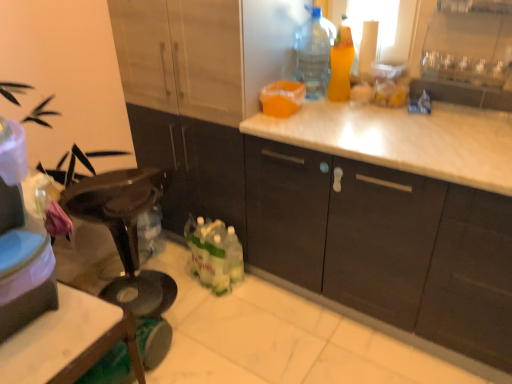
Question: Is transparent plastic bottle at upper right, the 1th bottle from the left, thinner than translucent orange spray bottle at upper right, marked as the 1th bottle in a right-to-left arrangement?

Choices:
 (A) yes
 (B) no

Answer: (B)

Question: Is transparent plastic bottle at upper right, the 1th bottle from the left, in contact with translucent orange spray bottle at upper right, marked as the 1th bottle in a right-to-left arrangement?

Choices:
 (A) yes
 (B) no

Answer: (A)

Question: Does transparent plastic bottle at upper right, the 1th bottle from the left, turn towards translucent orange spray bottle at upper right, marked as the 1th bottle in a right-to-left arrangement?

Choices:
 (A) no
 (B) yes

Answer: (A)

Question: Is transparent plastic bottle at upper right, the 1th bottle from the left, wider than translucent orange spray bottle at upper right, marked as the 1th bottle in a right-to-left arrangement?

Choices:
 (A) no
 (B) yes

Answer: (B)

Question: From a real-world perspective, is transparent plastic bottle at upper right, the 2th bottle positioned from the right, located higher than translucent orange spray bottle at upper right, marked as the second bottle in a left-to-right arrangement?

Choices:
 (A) yes
 (B) no

Answer: (A)

Question: Can you confirm if transparent plastic bottle at upper right, the 2th bottle positioned from the right, is taller than translucent orange spray bottle at upper right, marked as the second bottle in a left-to-right arrangement?

Choices:
 (A) no
 (B) yes

Answer: (B)

Question: Is translucent orange spray bottle at upper right, marked as the 1th bottle in a right-to-left arrangement, further to the viewer compared to transparent plastic bottle at upper right, the 2th bottle positioned from the right?

Choices:
 (A) yes
 (B) no

Answer: (B)

Question: From a real-world perspective, does translucent orange spray bottle at upper right, marked as the second bottle in a left-to-right arrangement, stand above transparent plastic bottle at upper right, the 2th bottle positioned from the right?

Choices:
 (A) no
 (B) yes

Answer: (A)

Question: From the image's perspective, does translucent orange spray bottle at upper right, marked as the second bottle in a left-to-right arrangement, appear lower than transparent plastic bottle at upper right, the 2th bottle positioned from the right?

Choices:
 (A) no
 (B) yes

Answer: (B)

Question: Is translucent orange spray bottle at upper right, marked as the 1th bottle in a right-to-left arrangement, aimed at transparent plastic bottle at upper right, the 2th bottle positioned from the right?

Choices:
 (A) yes
 (B) no

Answer: (B)

Question: Is translucent orange spray bottle at upper right, marked as the second bottle in a left-to-right arrangement, positioned before transparent plastic bottle at upper right, the 2th bottle positioned from the right?

Choices:
 (A) no
 (B) yes

Answer: (B)

Question: Is translucent orange spray bottle at upper right, marked as the second bottle in a left-to-right arrangement, oriented away from transparent plastic bottle at upper right, the 2th bottle positioned from the right?

Choices:
 (A) yes
 (B) no

Answer: (B)

Question: From the image's perspective, is transparent plastic bottle at upper right, the 1th bottle from the left, on top of matte plastic container at left?

Choices:
 (A) no
 (B) yes

Answer: (B)